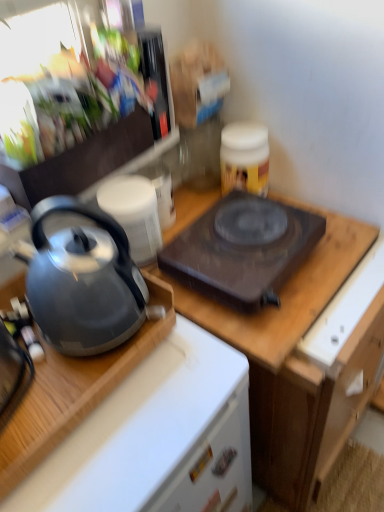
You are a GUI agent. You are given a task and a screenshot of the screen. Output one action in this format:
    pyautogui.click(x=<x>, y=<y>)
    Task: Click on the metallic silver kettle at upper left, placed as the 2th appliance when sorted from bottom to top
    
    Given the screenshot: What is the action you would take?
    pyautogui.click(x=76, y=106)

Image resolution: width=384 pixels, height=512 pixels. I want to click on shiny metallic kettle at left, the 2th appliance positioned from the top, so click(134, 213).

Describe the element at coordinates (213, 468) in the screenshot. I see `white matte drawer at lower center` at that location.

You are a GUI agent. You are given a task and a screenshot of the screen. Output one action in this format:
    pyautogui.click(x=<x>, y=<y>)
    Task: Click on the satin silver kettle at left
    The height and width of the screenshot is (512, 384).
    Given the screenshot: What is the action you would take?
    pyautogui.click(x=73, y=392)

The width and height of the screenshot is (384, 512). Describe the element at coordinates (83, 278) in the screenshot. I see `matte gray kettle at left` at that location.

Where is `metallic silver kettle at upper left, placed as the 2th appliance when sorted from bottom to top`? The image size is (384, 512). metallic silver kettle at upper left, placed as the 2th appliance when sorted from bottom to top is located at coordinates (76, 106).

Could you tell me if satin silver kettle at left is turned towards metallic silver kettle at upper left, placed as the 2th appliance when sorted from bottom to top?

No, satin silver kettle at left is not facing towards metallic silver kettle at upper left, placed as the 2th appliance when sorted from bottom to top.

Locate an element on the screen. The image size is (384, 512). desk directly beneath the metallic silver kettle at upper left, placed as the 2th appliance when sorted from bottom to top (from a real-world perspective) is located at coordinates (73, 392).

Between satin silver kettle at left and metallic silver kettle at upper left, the 1th appliance from the top, which one has larger size?

Bigger between the two is metallic silver kettle at upper left, the 1th appliance from the top.

Which is less distant, (143, 335) or (19, 199)?

Positioned in front is point (143, 335).

Does wooden cutting board at center come behind satin silver kettle at left?

Yes, the depth of wooden cutting board at center is greater than that of satin silver kettle at left.

Is wooden cutting board at center positioned with its back to satin silver kettle at left?

No.

At what (x,y) coordinates should I click in order to perform the action: click on counter top lying behind the satin silver kettle at left. Please return your answer as a coordinate pair (x, y). Looking at the image, I should click on (283, 293).

Does wooden cutting board at center touch satin silver kettle at left?

No.

From the image's perspective, which object appears higher, wooden cutting board at upper center or matte gray kettle at left?

matte gray kettle at left is shown above in the image.

Is wooden cutting board at upper center turned away from matte gray kettle at left?

No, wooden cutting board at upper center is not facing the opposite direction of matte gray kettle at left.

Which is more to the right, wooden cutting board at upper center or matte gray kettle at left?

From the viewer's perspective, wooden cutting board at upper center appears more on the right side.

From the picture: Can you confirm if wooden cutting board at upper center is bigger than matte gray kettle at left?

Yes, wooden cutting board at upper center is bigger than matte gray kettle at left.

Looking at this image, in terms of height, does metallic silver kettle at upper left, the 1th appliance from the top, look taller or shorter compared to wooden cutting board at center?

Clearly, metallic silver kettle at upper left, the 1th appliance from the top, is taller compared to wooden cutting board at center.

Does metallic silver kettle at upper left, placed as the 2th appliance when sorted from bottom to top, have a smaller size compared to wooden cutting board at center?

Incorrect, metallic silver kettle at upper left, placed as the 2th appliance when sorted from bottom to top, is not smaller in size than wooden cutting board at center.

Is metallic silver kettle at upper left, placed as the 2th appliance when sorted from bottom to top, oriented towards wooden cutting board at center?

No, metallic silver kettle at upper left, placed as the 2th appliance when sorted from bottom to top, is not oriented towards wooden cutting board at center.

From a real-world perspective, is metallic silver kettle at upper left, the 1th appliance from the top, positioned above or below wooden cutting board at center?

In terms of real-world spatial position, metallic silver kettle at upper left, the 1th appliance from the top, is above wooden cutting board at center.

Consider the image. What's the angular difference between shiny metallic kettle at left, the 2th appliance positioned from the top, and metallic silver kettle at upper left, the 1th appliance from the top,'s facing directions?

2.21 degrees.

Is shiny metallic kettle at left, the 2th appliance positioned from the top, looking in the opposite direction of metallic silver kettle at upper left, placed as the 2th appliance when sorted from bottom to top?

shiny metallic kettle at left, the 2th appliance positioned from the top, does not have its back to metallic silver kettle at upper left, placed as the 2th appliance when sorted from bottom to top.

From a real-world perspective, is shiny metallic kettle at left, which appears as the 1th appliance when ordered from the bottom, above or below metallic silver kettle at upper left, placed as the 2th appliance when sorted from bottom to top?

shiny metallic kettle at left, which appears as the 1th appliance when ordered from the bottom, is situated lower than metallic silver kettle at upper left, placed as the 2th appliance when sorted from bottom to top, in the real world.

Is shiny metallic kettle at left, which appears as the 1th appliance when ordered from the bottom, closer to the viewer compared to metallic silver kettle at upper left, the 1th appliance from the top?

No.

Is shiny metallic kettle at left, the 2th appliance positioned from the top, oriented towards satin silver kettle at left?

No, shiny metallic kettle at left, the 2th appliance positioned from the top, is not oriented towards satin silver kettle at left.

Where is `desk lying on the left of shiny metallic kettle at left, which appears as the 1th appliance when ordered from the bottom`? The width and height of the screenshot is (384, 512). desk lying on the left of shiny metallic kettle at left, which appears as the 1th appliance when ordered from the bottom is located at coordinates (73, 392).

Does shiny metallic kettle at left, the 2th appliance positioned from the top, have a lesser height compared to satin silver kettle at left?

Incorrect, the height of shiny metallic kettle at left, the 2th appliance positioned from the top, does not fall short of that of satin silver kettle at left.

In the scene shown: Can you confirm if shiny metallic kettle at left, which appears as the 1th appliance when ordered from the bottom, is positioned to the right of satin silver kettle at left?

Correct, you'll find shiny metallic kettle at left, which appears as the 1th appliance when ordered from the bottom, to the right of satin silver kettle at left.

In the scene shown: Measure the distance between matte gray kettle at left and shiny metallic kettle at left, which appears as the 1th appliance when ordered from the bottom.

They are 7.25 inches apart.

Consider the image. From the image's perspective, which one is positioned higher, matte gray kettle at left or shiny metallic kettle at left, which appears as the 1th appliance when ordered from the bottom?

shiny metallic kettle at left, which appears as the 1th appliance when ordered from the bottom, from the image's perspective.

Which object is thinner, matte gray kettle at left or shiny metallic kettle at left, the 2th appliance positioned from the top?

shiny metallic kettle at left, the 2th appliance positioned from the top.

Does matte gray kettle at left have a larger size compared to shiny metallic kettle at left, the 2th appliance positioned from the top?

Correct, matte gray kettle at left is larger in size than shiny metallic kettle at left, the 2th appliance positioned from the top.

Image resolution: width=384 pixels, height=512 pixels. Identify the location of desk below the metallic silver kettle at upper left, placed as the 2th appliance when sorted from bottom to top (from a real-world perspective). (73, 392).

This screenshot has width=384, height=512. Find the location of `desk located above the wooden cutting board at center (from a real-world perspective)`. desk located above the wooden cutting board at center (from a real-world perspective) is located at coordinates (73, 392).

Considering their positions, is metallic silver kettle at upper left, placed as the 2th appliance when sorted from bottom to top, positioned closer to black matte electric stove at center than wooden cutting board at center?

wooden cutting board at center is positioned closer to the anchor black matte electric stove at center.

Based on their spatial positions, is shiny metallic kettle at left, the 2th appliance positioned from the top, or black matte electric stove at center closer to wooden cutting board at upper center?

black matte electric stove at center lies closer to wooden cutting board at upper center than the other object.

Considering their positions, is wooden cutting board at center positioned closer to metallic silver kettle at upper left, placed as the 2th appliance when sorted from bottom to top, than satin silver kettle at left?

wooden cutting board at center lies closer to metallic silver kettle at upper left, placed as the 2th appliance when sorted from bottom to top, than the other object.

Looking at this image, estimate the real-world distances between objects in this image. Which object is closer to shiny metallic kettle at left, the 2th appliance positioned from the top, wooden cutting board at center or matte gray kettle at left?

matte gray kettle at left.

Based on their spatial positions, is white matte drawer at lower center or wooden cutting board at upper center further from metallic silver kettle at upper left, placed as the 2th appliance when sorted from bottom to top?

Based on the image, white matte drawer at lower center appears to be further to metallic silver kettle at upper left, placed as the 2th appliance when sorted from bottom to top.

Considering their positions, is wooden cutting board at upper center positioned further to shiny metallic kettle at left, the 2th appliance positioned from the top, than satin silver kettle at left?

The object further to shiny metallic kettle at left, the 2th appliance positioned from the top, is wooden cutting board at upper center.

From the image, which object appears to be nearer to matte gray kettle at left, wooden cutting board at center or metallic silver kettle at upper left, placed as the 2th appliance when sorted from bottom to top?

metallic silver kettle at upper left, placed as the 2th appliance when sorted from bottom to top.

Considering their positions, is wooden cutting board at center positioned further to matte gray kettle at left than shiny metallic kettle at left, the 2th appliance positioned from the top?

The object further to matte gray kettle at left is wooden cutting board at center.

The image size is (384, 512). I want to click on gas stove between metallic silver kettle at upper left, the 1th appliance from the top, and wooden cutting board at upper center vertically, so [242, 249].

Where is `kettle located between metallic silver kettle at upper left, placed as the 2th appliance when sorted from bottom to top, and black matte electric stove at center in the left-right direction`? Image resolution: width=384 pixels, height=512 pixels. kettle located between metallic silver kettle at upper left, placed as the 2th appliance when sorted from bottom to top, and black matte electric stove at center in the left-right direction is located at coordinates (83, 278).

The image size is (384, 512). In order to click on kettle between metallic silver kettle at upper left, the 1th appliance from the top, and satin silver kettle at left from top to bottom in this screenshot , I will do `click(83, 278)`.

Locate an element on the screen. gas stove that lies between shiny metallic kettle at left, which appears as the 1th appliance when ordered from the bottom, and white matte drawer at lower center from top to bottom is located at coordinates (242, 249).